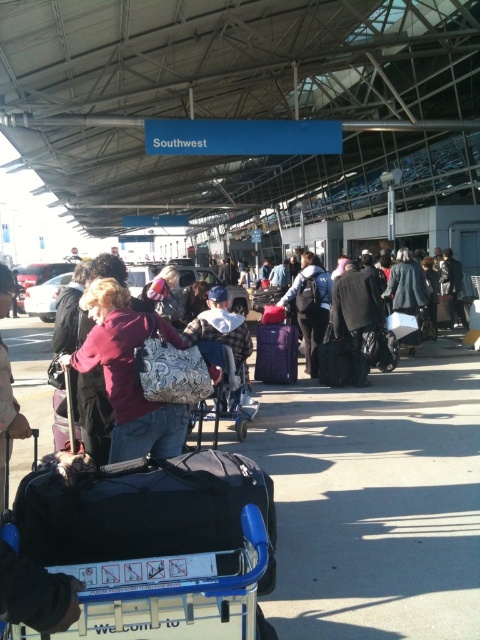
Who is shorter, matte maroon coat at center or black fuzzy coat at center?

matte maroon coat at center

Does point (87, 300) lie behind point (368, 288)?

No.

This screenshot has height=640, width=480. Identify the location of matte maroon coat at center. (128, 372).

Is point (358, 385) positioned before point (304, 284)?

Yes, it is.

The image size is (480, 640). What are the coordinates of `black fuzzy coat at center` in the screenshot? It's located at (357, 314).

Does blue plastic cart at center lie behind dark blue backpack at center?

No.

Can you confirm if blue plastic cart at center is positioned to the left of dark blue backpack at center?

Indeed, blue plastic cart at center is positioned on the left side of dark blue backpack at center.

Where is `blue plastic cart at center`? The height and width of the screenshot is (640, 480). blue plastic cart at center is located at coordinates (175, 593).